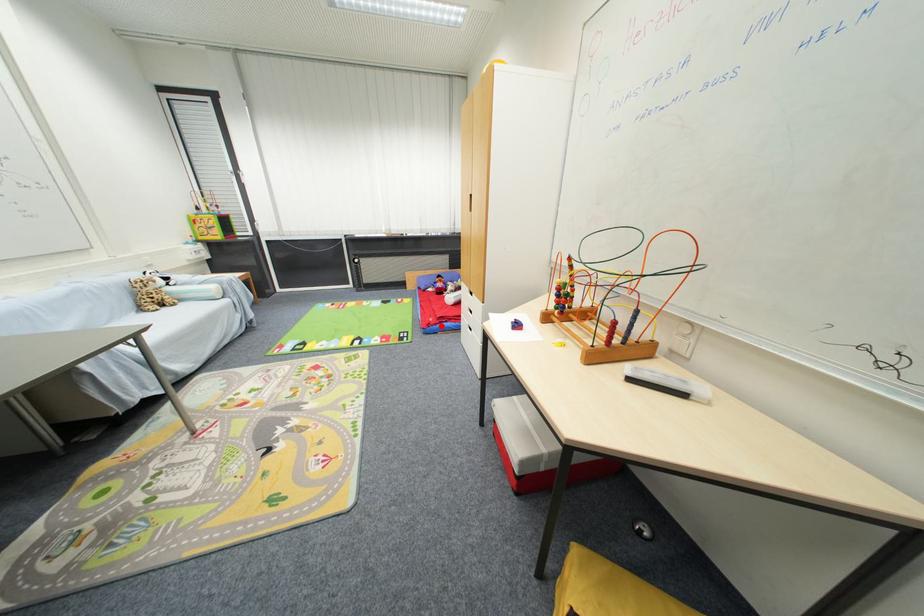
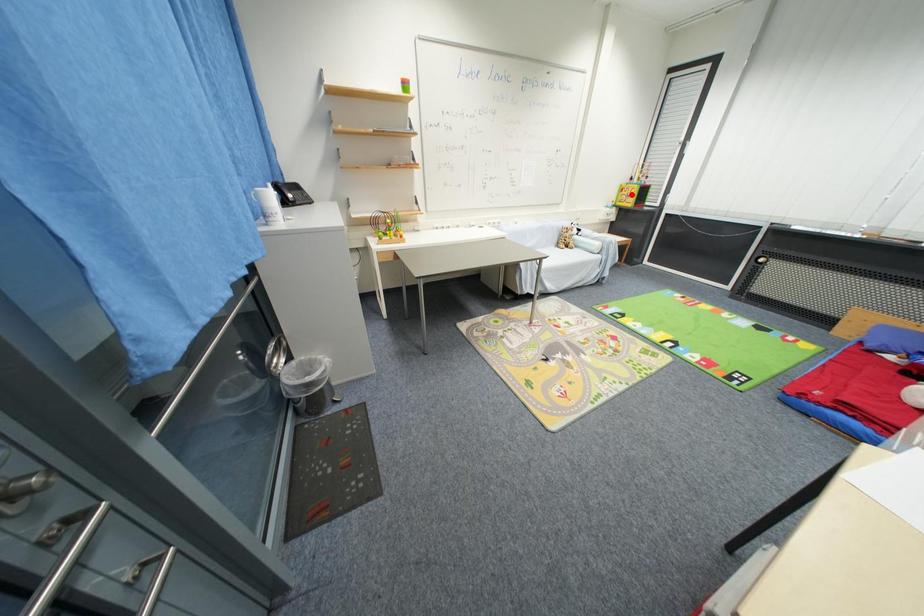
I am providing you with two images of the same scene from different viewpoints. A red point is marked on the first image and another point is marked on the second image. Is the red point in image1 aligned with the point shown in image2?

No